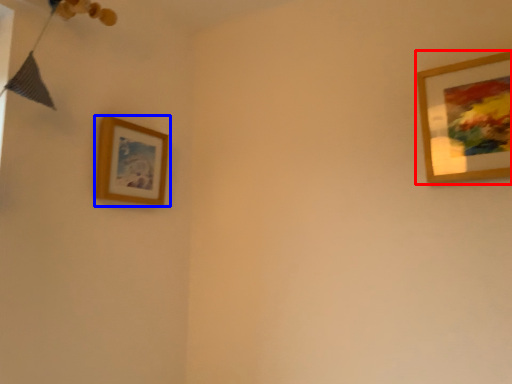
Question: Which point is further to the camera, picture frame (highlighted by a red box) or picture frame (highlighted by a blue box)?

Choices:
 (A) picture frame
 (B) picture frame

Answer: (B)